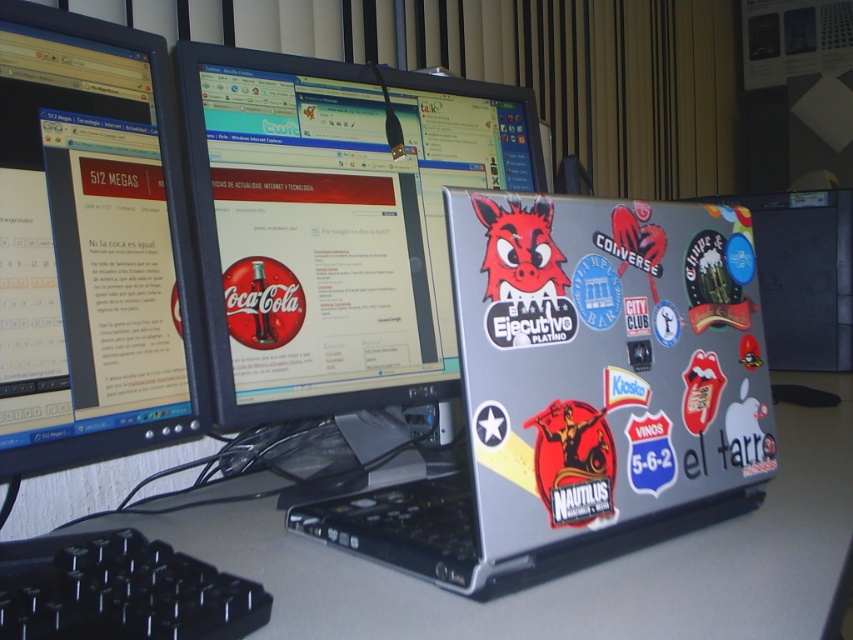
Measure the distance between silver/stickered laptop at center and camera.

The distance of silver/stickered laptop at center from camera is 21.42 inches.

Which is in front, point (529, 244) or point (200, 580)?

Point (200, 580) is more forward.

Where is `silver/stickered laptop at center`? Image resolution: width=853 pixels, height=640 pixels. silver/stickered laptop at center is located at coordinates (581, 392).

Can you confirm if matte black monitor at center is bigger than black glossy monitor at left?

Yes.

Which is below, matte black monitor at center or black glossy monitor at left?

black glossy monitor at left is below.

Which is behind, point (274, 356) or point (9, 109)?

The point (274, 356) is behind.

The image size is (853, 640). What are the coordinates of `matte black monitor at center` in the screenshot? It's located at (335, 224).

Between silver/stickered laptop at center and matte black monitor at center, which one has more height?

matte black monitor at center

Is silver/stickered laptop at center bigger than matte black monitor at center?

No.

Image resolution: width=853 pixels, height=640 pixels. I want to click on silver/stickered laptop at center, so click(581, 392).